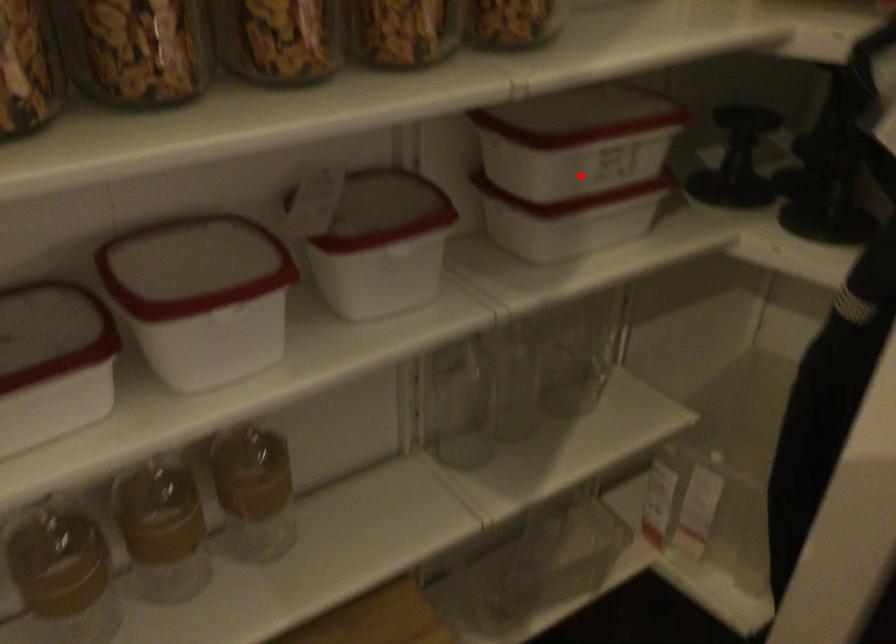
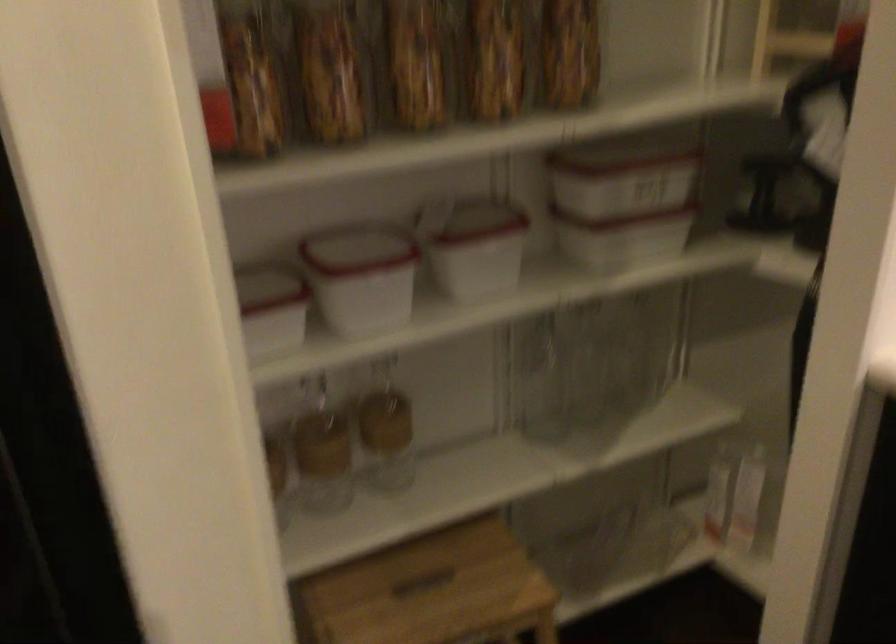
Question: I am providing you with two images of the same scene from different viewpoints. Image1 has a red point marked. In image2, the corresponding 3D location appears at what relative position? Reply with the corresponding letter.

Choices:
 (A) Closer
 (B) Farther

Answer: (B)